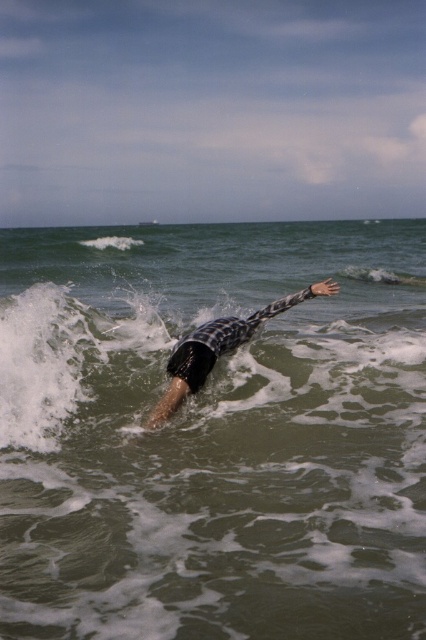
Is greenish water at center shorter than black checkered wetsuit at center?

No.

Locate an element on the screen. greenish water at center is located at coordinates (213, 435).

Who is more forward, (x=20, y=438) or (x=198, y=332)?

Point (x=20, y=438)

Locate an element on the screen. The height and width of the screenshot is (640, 426). greenish water at center is located at coordinates (213, 435).